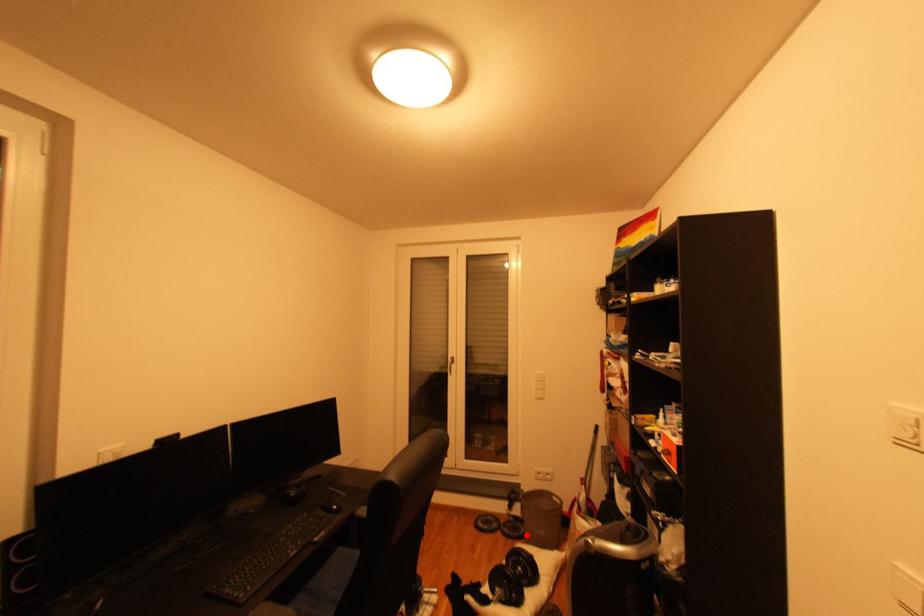
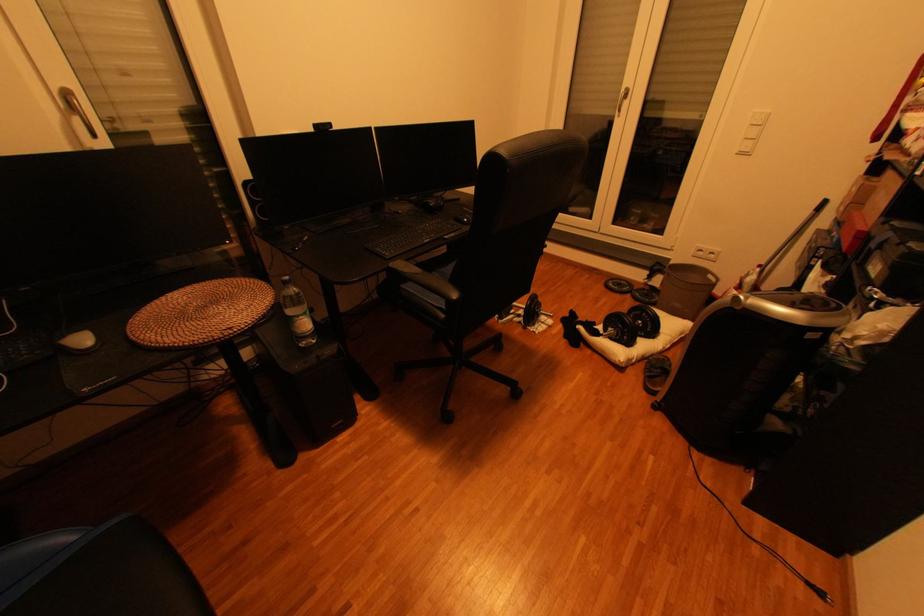
Question: I am providing you with two images of the same scene from different viewpoints. A red point is marked on the first image. Can you still see the location of the red point in image 2?

Choices:
 (A) Yes
 (B) No

Answer: (A)